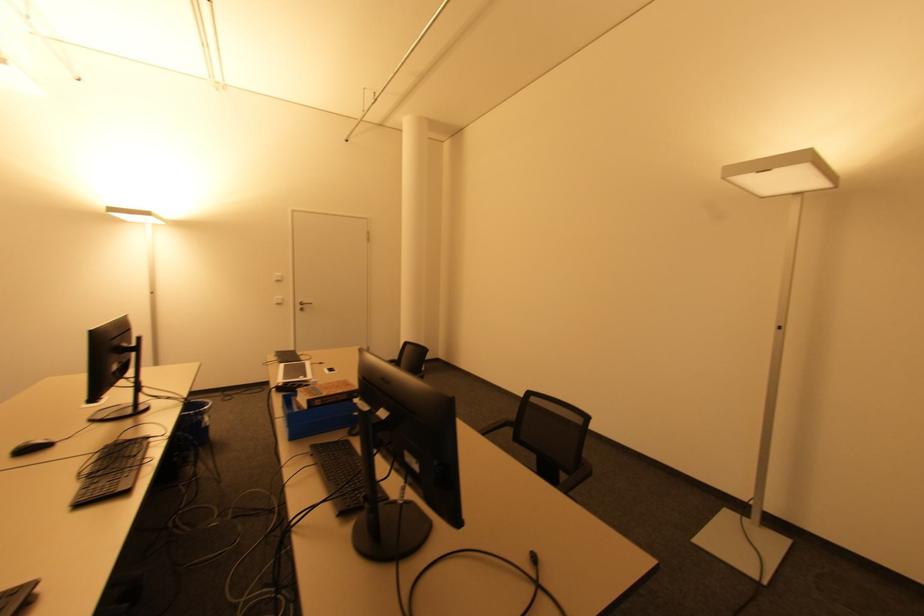
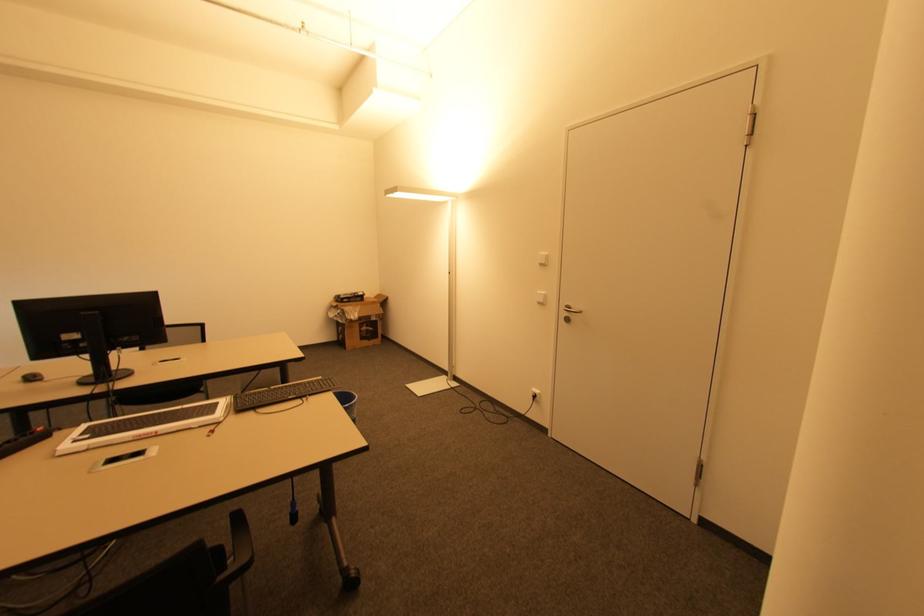
The point at [304,310] is marked in the first image. Where is the corresponding point in the second image?

(568, 320)